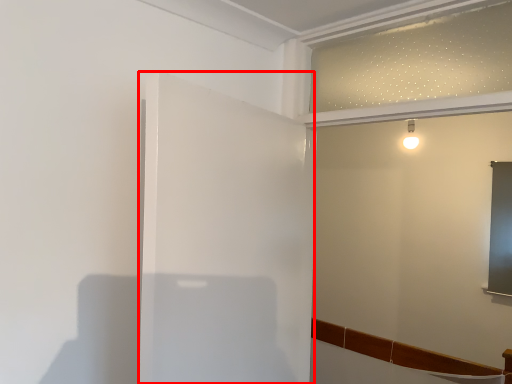
Question: From the image's perspective, considering the relative positions of screen door (annotated by the red box) and backdrop in the image provided, where is screen door (annotated by the red box) located with respect to the staircase?

Choices:
 (A) above
 (B) below

Answer: (B)